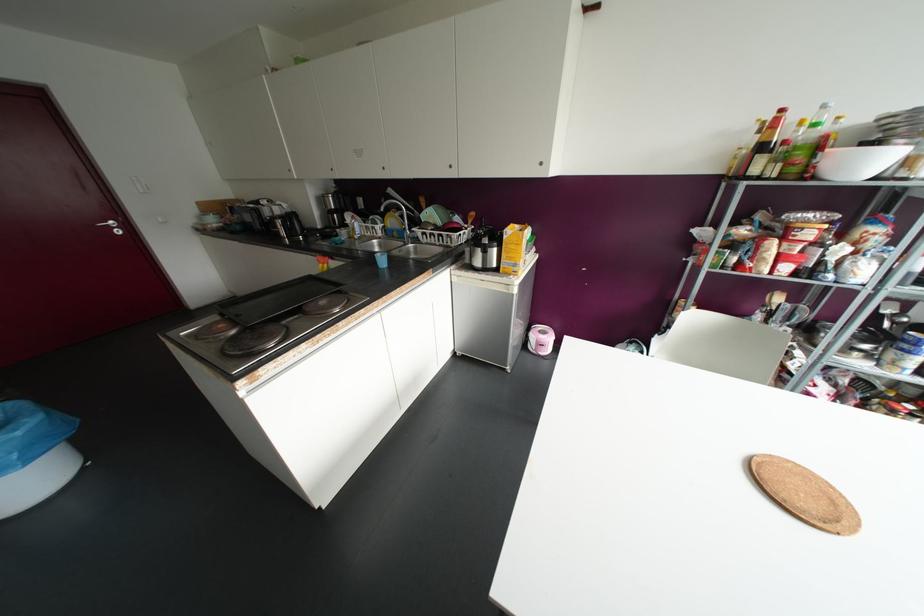
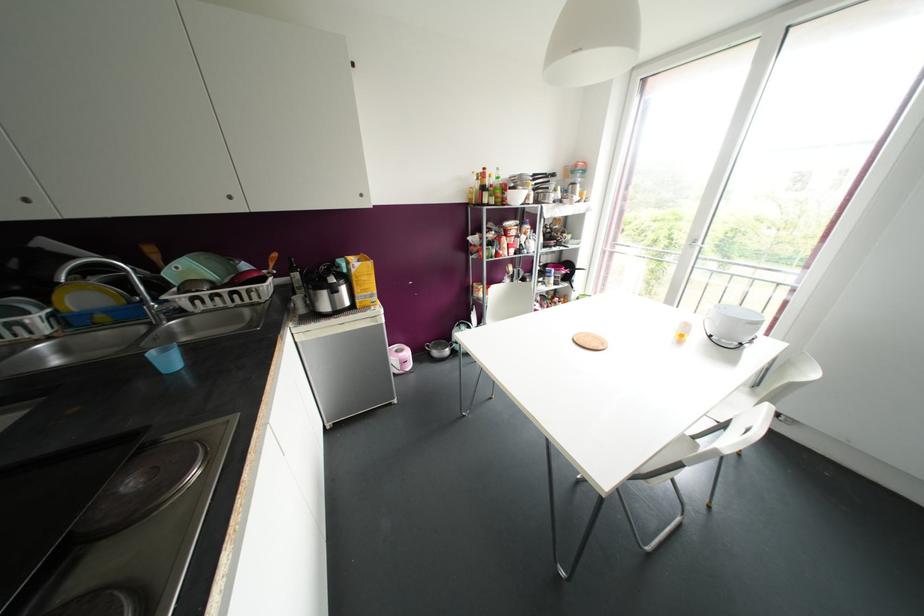
The point at (394,233) is marked in the first image. Where is the corresponding point in the second image?

(101, 317)